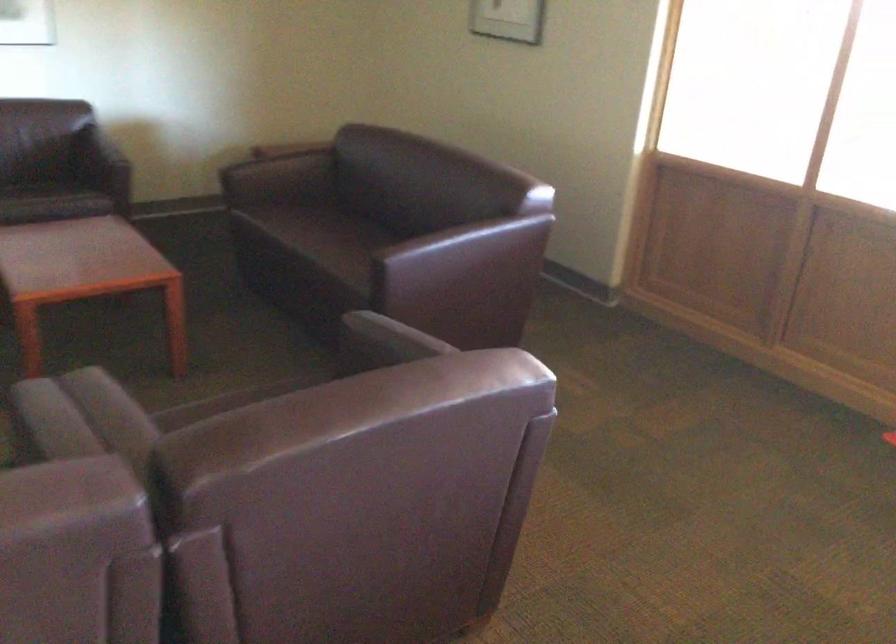
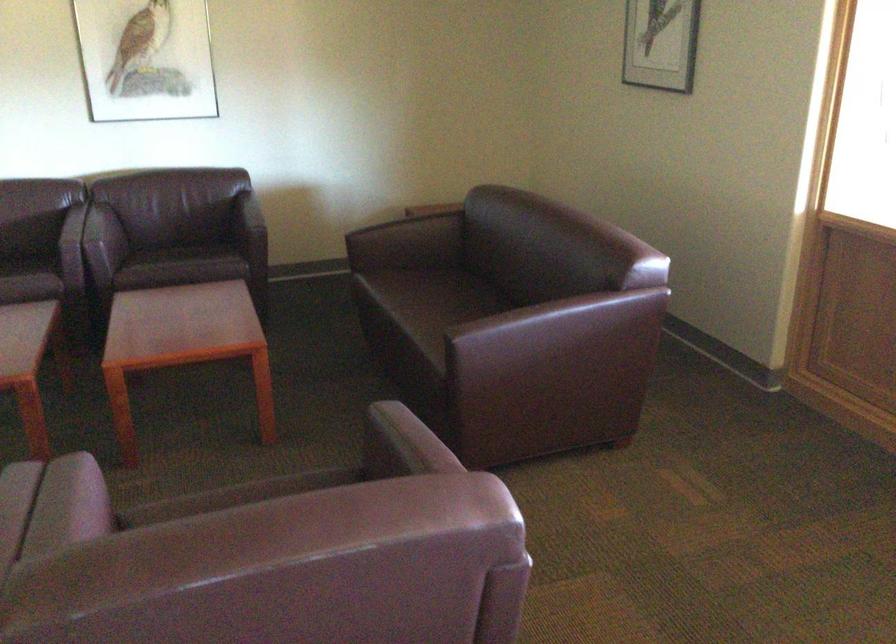
Locate, in the second image, the point that corresponds to (401,337) in the first image.

(390, 440)